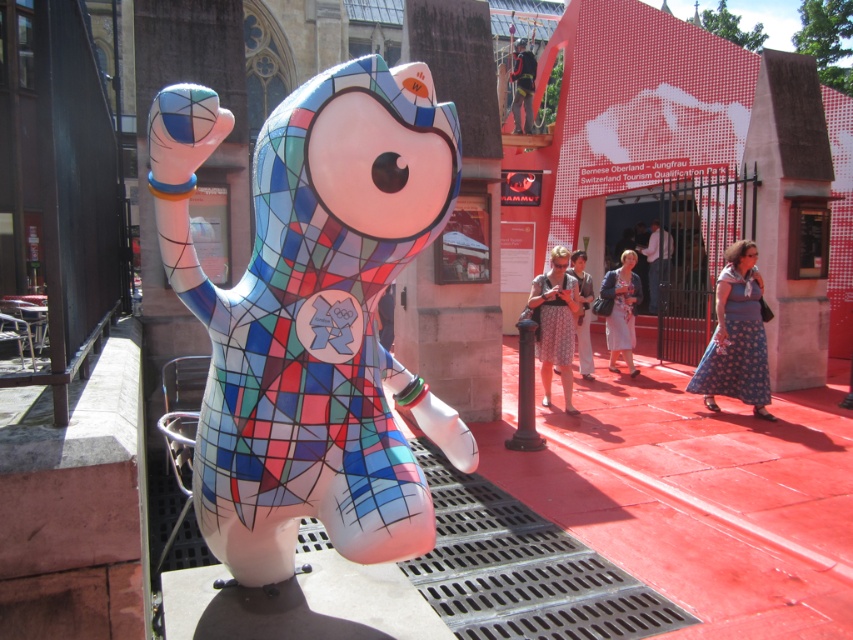
You are a photographer standing 10 meters away from the colorful sculpture. You want to take a photo of both the patterned fabric dress at center and the blue fabric dress at center in the same frame. Can you fit both dresses into the photo without moving closer or farther away?

The patterned fabric dress at center and blue fabric dress at center are 7.67 meters apart. Since you are standing 10 meters away from the sculpture, the distance between the dresses is less than your distance from the sculpture. This means both dresses can likely be captured in the same frame without needing to adjust your position.

You are a photographer trying to capture the Olympic mascot sculpture in the background. You notice a person wearing a blue dotted dress at center and dark blue fabric pants at center. Which clothing item is located to the right of the other?

The blue dotted dress at center is positioned on the right side of dark blue fabric pants at center, so the blue dotted dress at center is to the right of the dark blue fabric pants at center.

You are a photographer trying to capture the Olympic mascot sculpture in the background. You notice two items in the scene, the blue floral dress at center and the dark blue fabric pants at center. Which item should you focus on to ensure it is fully visible in your photo since it is taller?

The dark blue fabric pants at center are taller than the blue floral dress at center, so focusing on the dark blue fabric pants at center will ensure it is fully visible in the photo.